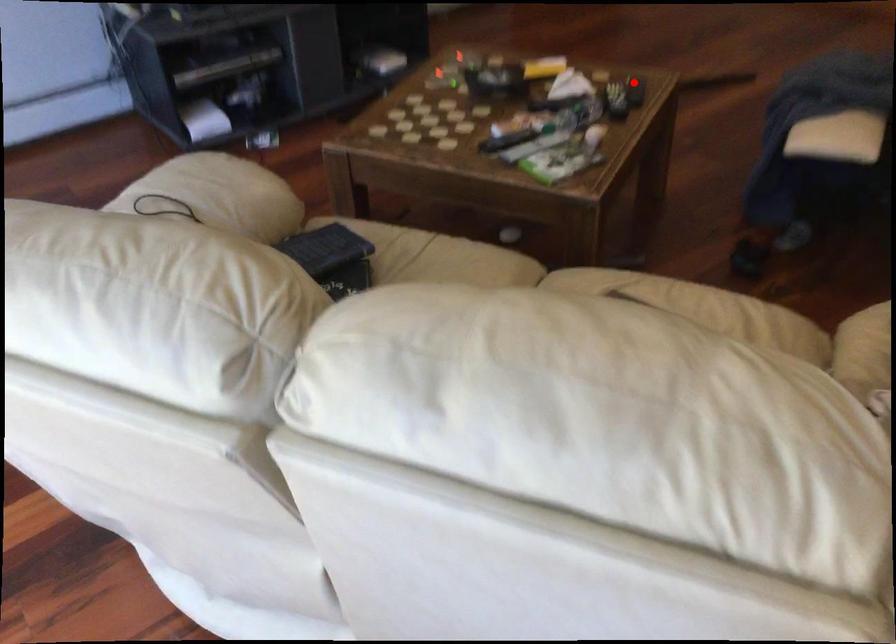
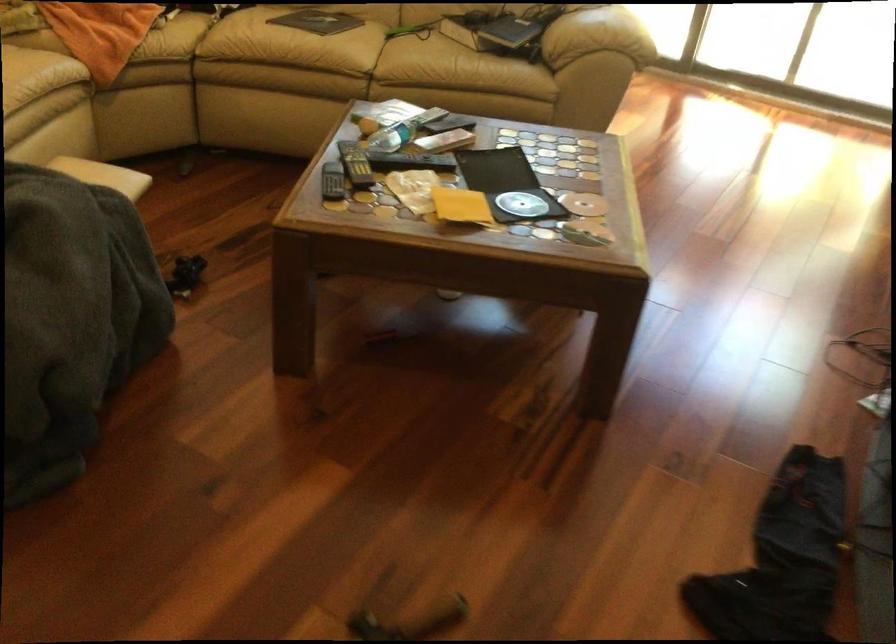
Locate, in the second image, the point that corresponds to the highlighted location in the first image.

(332, 182)